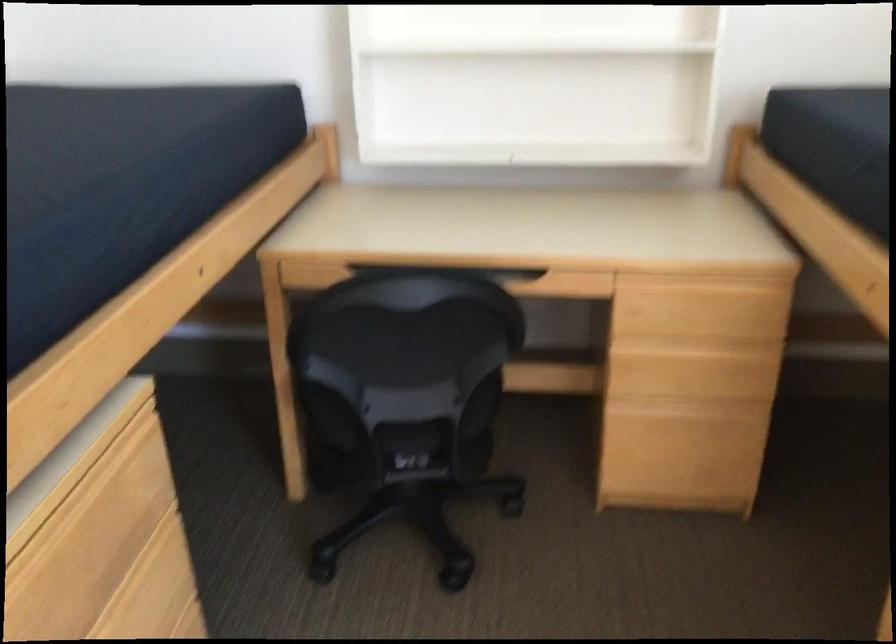
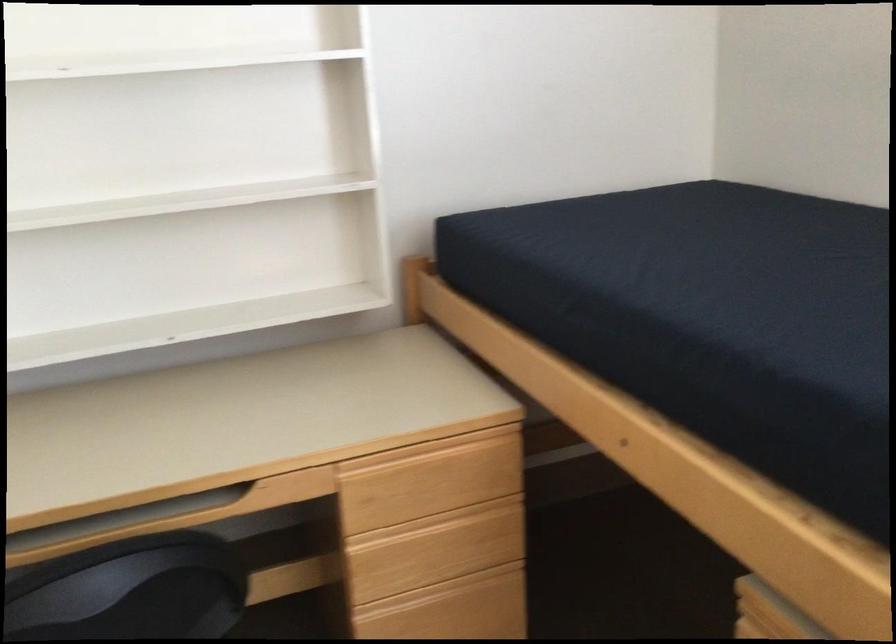
Locate, in the second image, the point that corresponds to pixel 682 410 in the first image.

(442, 592)